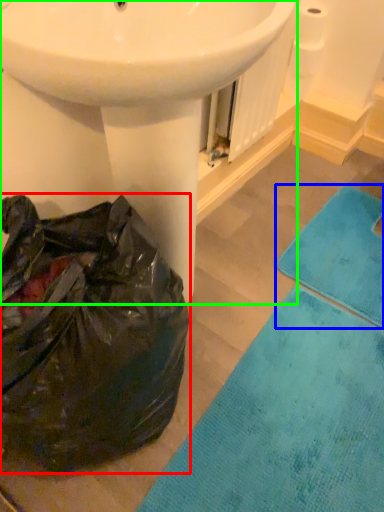
Question: Considering the real-world distances, which object is closest to paper bag (highlighted by a red box)? bath towel (highlighted by a blue box) or sink (highlighted by a green box).

Choices:
 (A) bath towel
 (B) sink

Answer: (B)